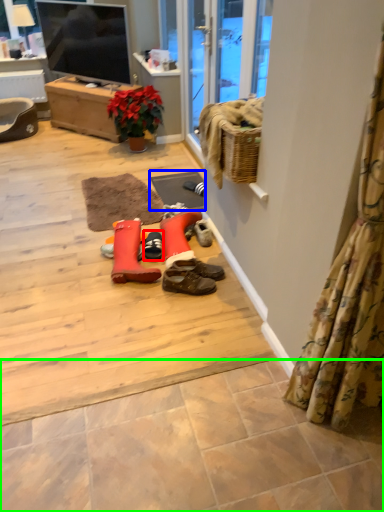
Question: Considering the real-world distances, which object is farthest from footwear (highlighted by a red box)? doormat (highlighted by a blue box) or tile (highlighted by a green box)?

Choices:
 (A) doormat
 (B) tile

Answer: (B)